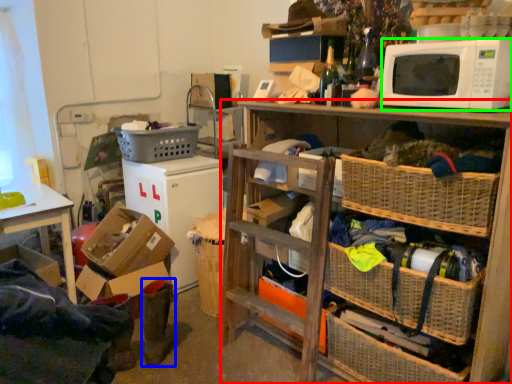
Question: Which object is the farthest from shelf (highlighted by a red box)? Choose among these: boots (highlighted by a blue box) or microwave oven (highlighted by a green box).

Choices:
 (A) boots
 (B) microwave oven

Answer: (A)